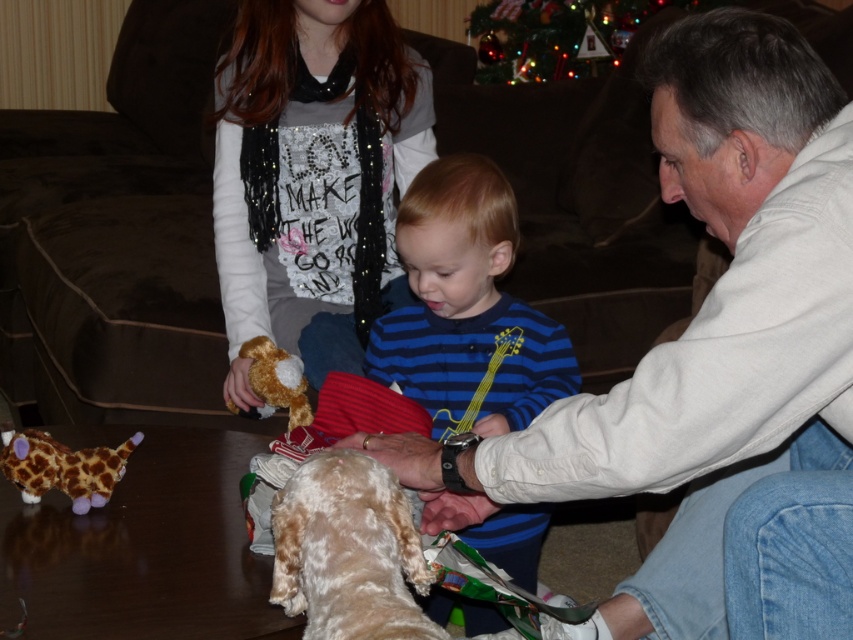
You are a guest at the festive gathering and want to take a photo with the sparkly sequin shirt at upper center and the shiny tinsel garland at upper center. Which object should you focus on first to ensure both are in the frame?

The sparkly sequin shirt at upper center is smaller than the shiny tinsel garland at upper center, so you should focus on the shiny tinsel garland at upper center first to ensure both fit in the frame.

You are trying to decide whether to place a new decorative item on the table between the blue striped shirt at center and the plush giraffe at lower left. Based on their sizes, which object should you consider moving to make space?

The blue striped shirt at center might be wider than the plush giraffe at lower left, so moving the plush giraffe at lower left could be easier to create space.

You are a guest at a festive gathering and want to take a photo of the sparkly sequin shirt at upper center and the shiny tinsel garland at upper center. Which object should you focus on first if you want to capture both in the same frame without moving the camera?

You should focus on the sparkly sequin shirt at upper center first because it is taller than the shiny tinsel garland at upper center, ensuring it fits within the frame when centered.